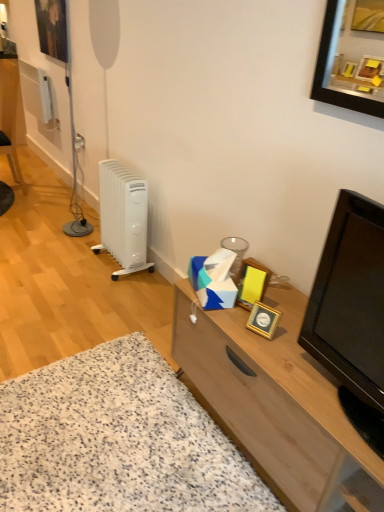
Where is `free space to the left of black glossy television at right`? This screenshot has height=512, width=384. free space to the left of black glossy television at right is located at coordinates (282, 367).